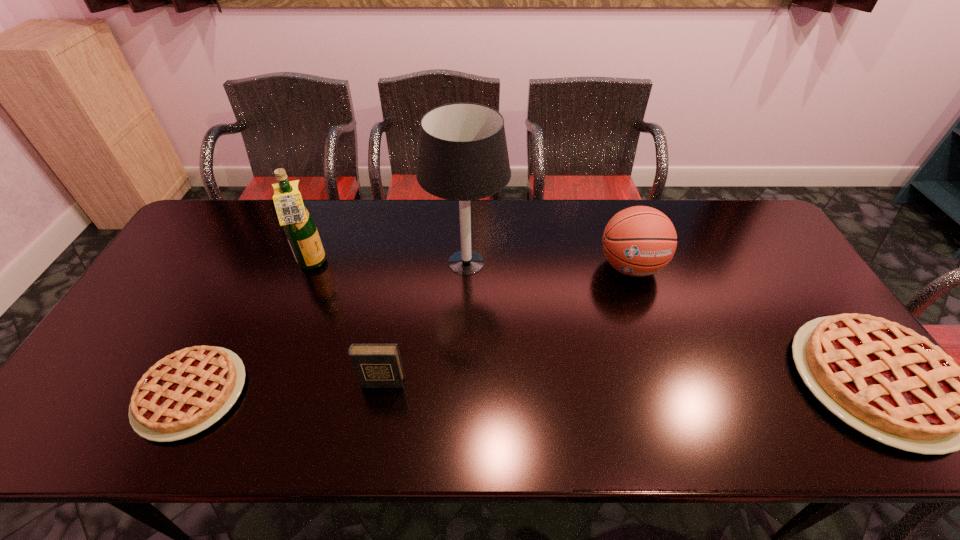
You are a GUI agent. You are given a task and a screenshot of the screen. Output one action in this format:
    pyautogui.click(x=<x>, y=<y>)
    Task: Click on the empty space that is in between the shorter pie and the fifth shortest object
    This screenshot has width=960, height=540.
    Given the screenshot: What is the action you would take?
    pyautogui.click(x=252, y=329)

You are a GUI agent. You are given a task and a screenshot of the screen. Output one action in this format:
    pyautogui.click(x=<x>, y=<y>)
    Task: Click on the free spot between the fifth object from right to left and the shorter pie
    
    Given the screenshot: What is the action you would take?
    pyautogui.click(x=252, y=329)

This screenshot has height=540, width=960. I want to click on object that is the second closest to the fourth shortest object, so click(x=463, y=156).

Choose which object is the fifth nearest neighbor to the table lamp. Please provide its 2D coordinates. Your answer should be formatted as a tuple, i.e. [(x, y)], where the tuple contains the x and y coordinates of a point satisfying the conditions above.

[(886, 381)]

I want to click on vacant area that satisfies the following two spatial constraints: 1. on the front side of the third object from right to left; 2. on the front-facing side of the fifth shortest object, so click(467, 264).